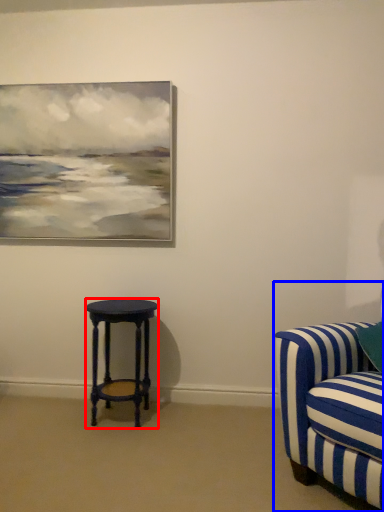
Question: Which object appears closest to the camera in this image, stool (highlighted by a red box) or studio couch (highlighted by a blue box)?

Choices:
 (A) stool
 (B) studio couch

Answer: (B)